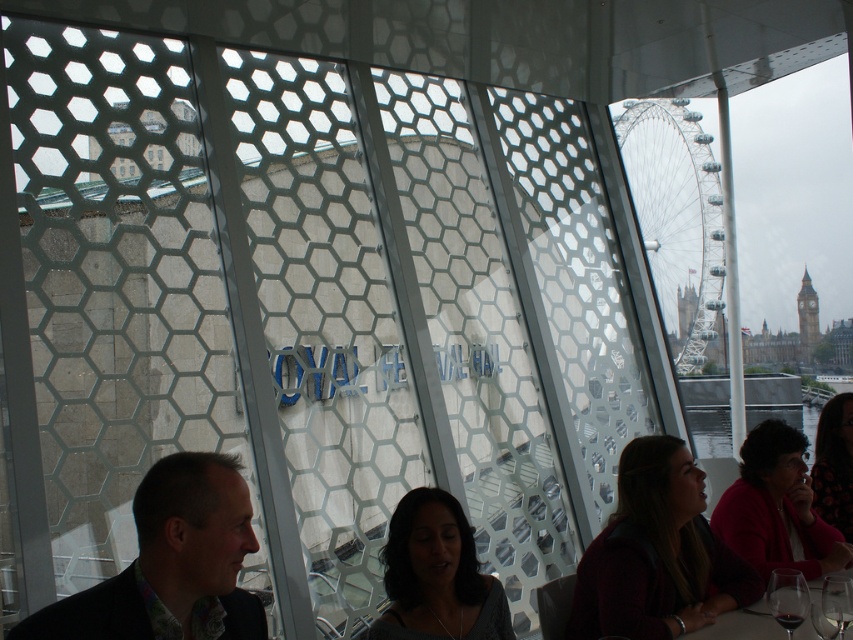
Question: Which point is closer to the camera taking this photo?

Choices:
 (A) (434, 545)
 (B) (845, 592)
 (C) (645, 588)

Answer: (B)

Question: Which of the following is the farthest from the observer?

Choices:
 (A) gray textured shirt at center
 (B) transparent glass wine glass at lower right

Answer: (A)

Question: Where is matte pink sweater at lower right located in relation to transparent glass table at lower right in the image?

Choices:
 (A) above
 (B) below

Answer: (A)

Question: Can you confirm if matte pink sweater at lower right is smaller than transparent glass at lower right?

Choices:
 (A) no
 (B) yes

Answer: (A)

Question: Can you confirm if dark brown leather jacket at lower right is positioned below matte pink sweater at lower right?

Choices:
 (A) yes
 (B) no

Answer: (A)

Question: Which object appears closest to the camera in this image?

Choices:
 (A) transparent glass table at lower right
 (B) dark brown leather jacket at lower right
 (C) transparent glass at lower right

Answer: (C)